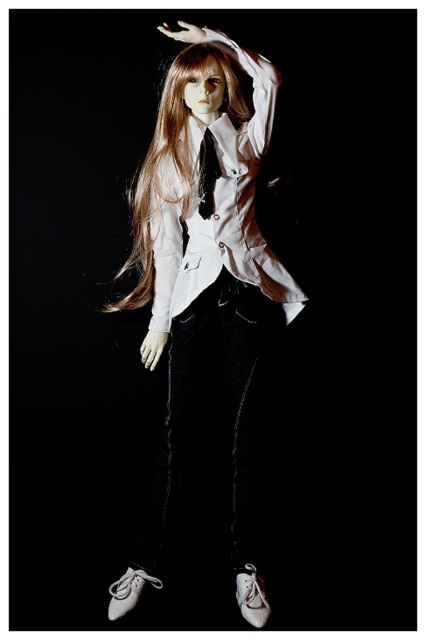
In the scene shown: Can you confirm if black velvet pants at center is wider than black satin tie at center?

Yes, black velvet pants at center is wider than black satin tie at center.

Which is behind, point (181, 394) or point (198, 184)?

Point (181, 394)

This screenshot has height=640, width=426. In order to click on black velvet pants at center in this screenshot , I will do `click(210, 433)`.

Is matte white shirt at center below white leather shoe at lower left?

No, matte white shirt at center is not below white leather shoe at lower left.

Consider the image. Does matte white shirt at center have a smaller size compared to white leather shoe at lower left?

No, matte white shirt at center is not smaller than white leather shoe at lower left.

Who is more distant from viewer, [203,401] or [253,564]?

The point [203,401] is more distant.

The width and height of the screenshot is (426, 640). What are the coordinates of `matte white shirt at center` in the screenshot? It's located at (206, 291).

How much distance is there between smooth brown hair at center and white leather shoe at lower center?

smooth brown hair at center and white leather shoe at lower center are 38.97 inches apart from each other.

Is smooth brown hair at center in front of white leather shoe at lower center?

No, it is behind white leather shoe at lower center.

Locate an element on the screen. Image resolution: width=426 pixels, height=640 pixels. smooth brown hair at center is located at coordinates (172, 163).